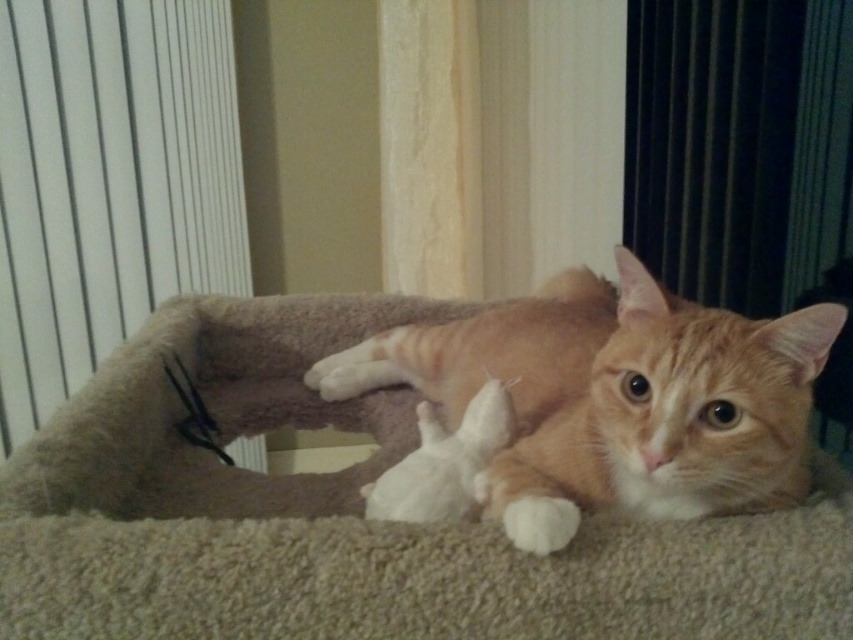
What do you see at coordinates (350, 515) in the screenshot? I see `beige plush cat bed at center` at bounding box center [350, 515].

Is beige plush cat bed at center wider than orange fur cat at center?

Indeed, beige plush cat bed at center has a greater width compared to orange fur cat at center.

This screenshot has height=640, width=853. I want to click on beige plush cat bed at center, so click(x=350, y=515).